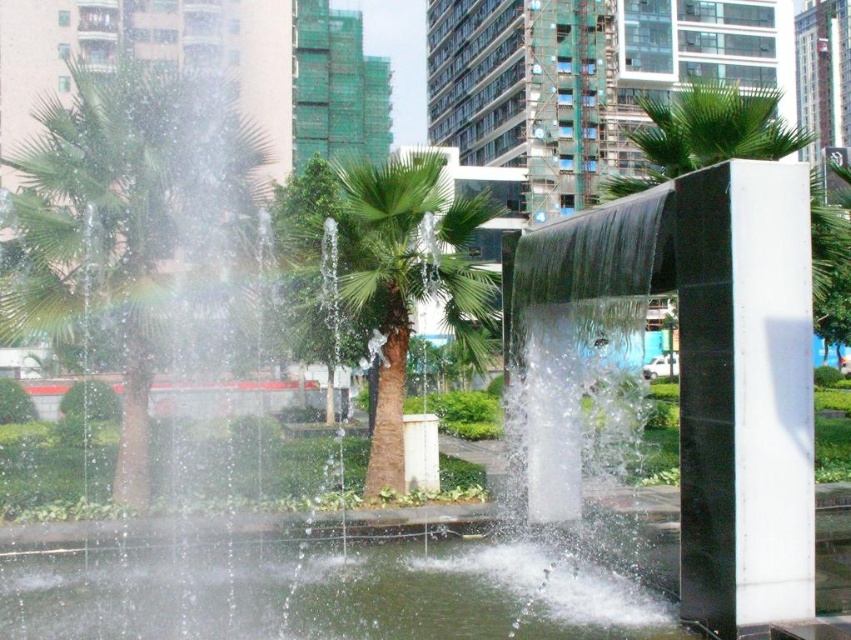
Can you confirm if black polished stone pillar at right is positioned above green leafy palm tree at left?

No.

Who is higher up, black polished stone pillar at right or green leafy palm tree at left?

green leafy palm tree at left is above.

Is point (792, 168) positioned behind point (134, 435)?

No, (792, 168) is closer to viewer.

The width and height of the screenshot is (851, 640). What are the coordinates of `black polished stone pillar at right` in the screenshot? It's located at (744, 394).

Is point (103, 579) positioned in front of point (72, 192)?

Yes, point (103, 579) is closer to viewer.

Which is in front, point (433, 552) or point (89, 288)?

Point (433, 552)

Does point (450, 604) come farther from viewer compared to point (129, 150)?

That is False.

This screenshot has height=640, width=851. What are the coordinates of `clear water at center` in the screenshot? It's located at (321, 593).

Who is taller, black polished stone pillar at right or green leafy palm tree at center?

green leafy palm tree at center

In the scene shown: Can you confirm if black polished stone pillar at right is smaller than green leafy palm tree at center?

Yes, black polished stone pillar at right is smaller than green leafy palm tree at center.

Who is more distant from viewer, (800,342) or (386,420)?

Positioned behind is point (386,420).

I want to click on black polished stone pillar at right, so click(744, 394).